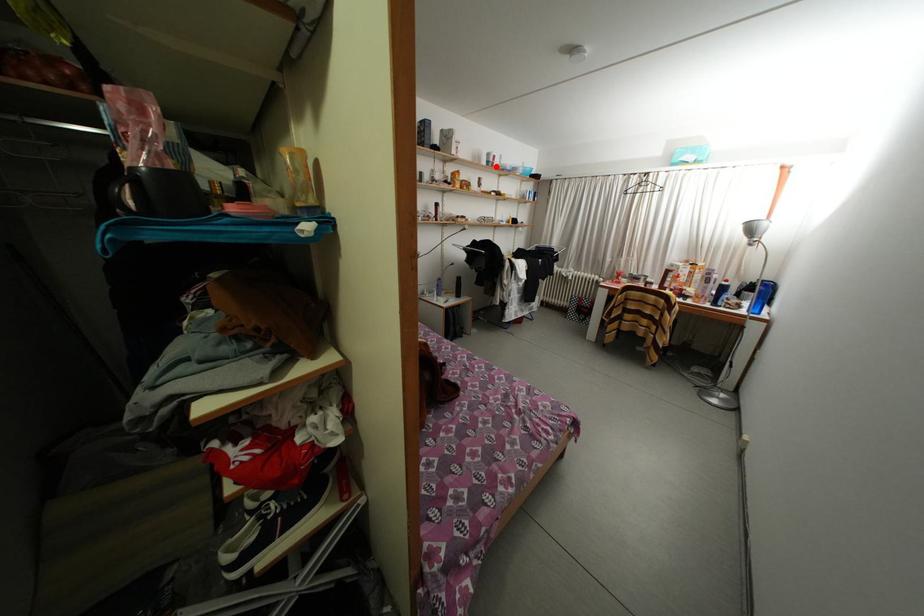
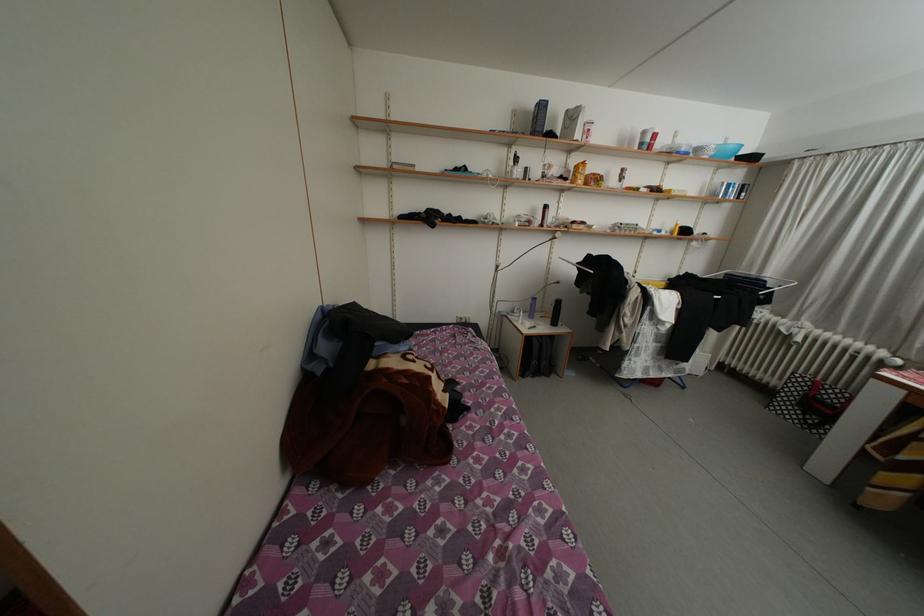
Find the pixel in the second image that matches the highlighted location in the first image.

(650, 148)